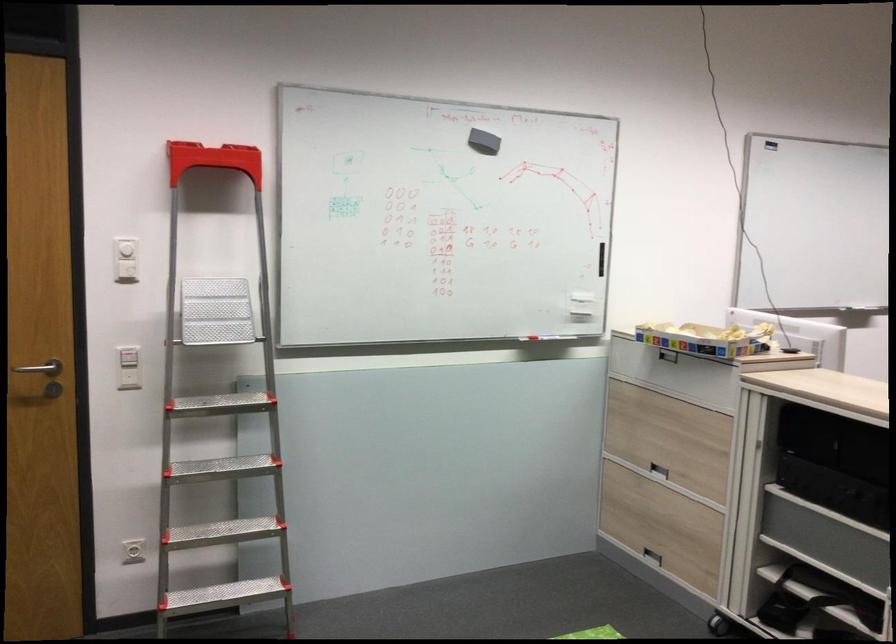
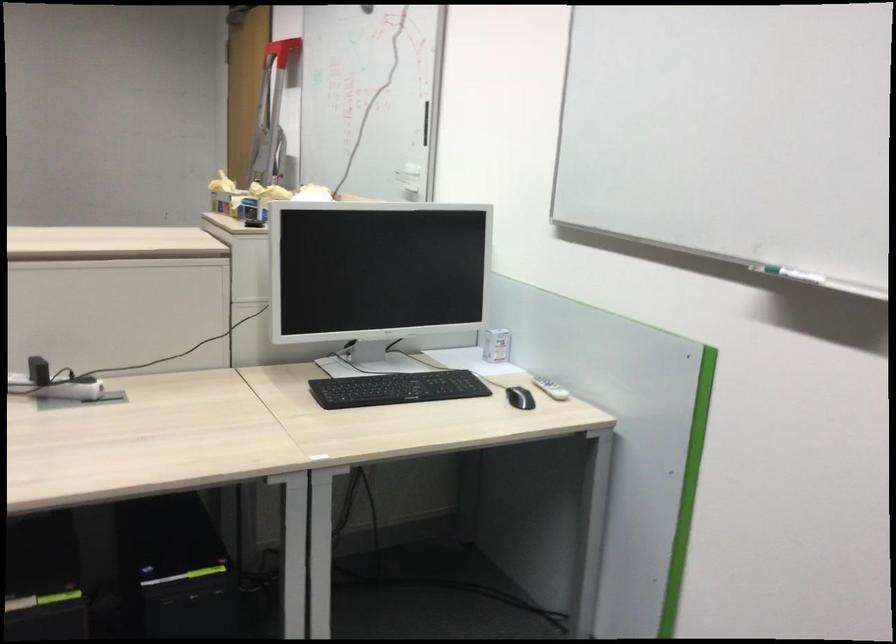
In the second image, find the point that corresponds to the point at 576,263 in the first image.

(426, 122)